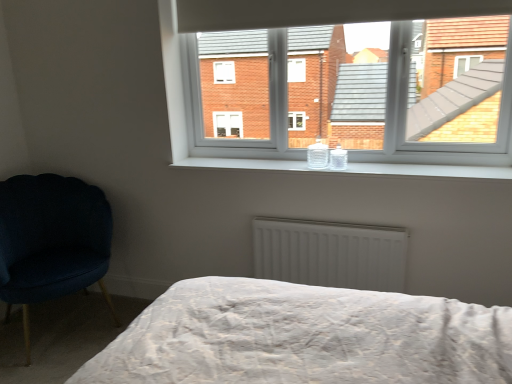
Question: Does white plastic window at upper center have a lesser width compared to white matte radiator at center?

Choices:
 (A) no
 (B) yes

Answer: (A)

Question: Would you say white plastic window at upper center is a long distance from white matte radiator at center?

Choices:
 (A) yes
 (B) no

Answer: (B)

Question: Is white plastic window at upper center next to white matte radiator at center?

Choices:
 (A) no
 (B) yes

Answer: (A)

Question: Can you confirm if white plastic window at upper center is taller than white matte radiator at center?

Choices:
 (A) no
 (B) yes

Answer: (B)

Question: Does white plastic window at upper center have a larger size compared to white matte radiator at center?

Choices:
 (A) yes
 (B) no

Answer: (A)

Question: In the image, is white plastic window at upper center positioned in front of or behind white glossy window sill at center?

Choices:
 (A) behind
 (B) front

Answer: (A)

Question: Is point (283, 157) positioned closer to the camera than point (327, 170)?

Choices:
 (A) farther
 (B) closer

Answer: (A)

Question: Is white plastic window at upper center wider or thinner than white glossy window sill at center?

Choices:
 (A) wide
 (B) thin

Answer: (B)

Question: Which is correct: white plastic window at upper center is inside white glossy window sill at center, or outside of it?

Choices:
 (A) inside
 (B) outside

Answer: (B)

Question: Is white glossy window sill at center in front of or behind velvet dark blue chair at left in the image?

Choices:
 (A) behind
 (B) front

Answer: (A)

Question: Considering the relative positions of white glossy window sill at center and velvet dark blue chair at left in the image provided, is white glossy window sill at center to the left or to the right of velvet dark blue chair at left?

Choices:
 (A) right
 (B) left

Answer: (A)

Question: Is white glossy window sill at center inside or outside of velvet dark blue chair at left?

Choices:
 (A) inside
 (B) outside

Answer: (B)

Question: Is white glossy window sill at center taller or shorter than velvet dark blue chair at left?

Choices:
 (A) tall
 (B) short

Answer: (B)

Question: Is white matte radiator at center taller or shorter than velvet dark blue chair at left?

Choices:
 (A) short
 (B) tall

Answer: (A)

Question: Is white matte radiator at center situated inside velvet dark blue chair at left or outside?

Choices:
 (A) inside
 (B) outside

Answer: (B)